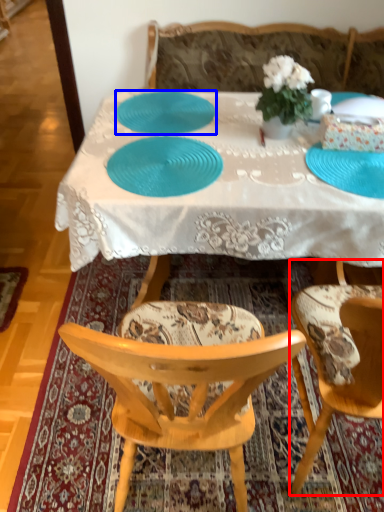
Question: Among these objects, which one is farthest to the camera, chair (highlighted by a red box) or plate (highlighted by a blue box)?

Choices:
 (A) chair
 (B) plate

Answer: (B)